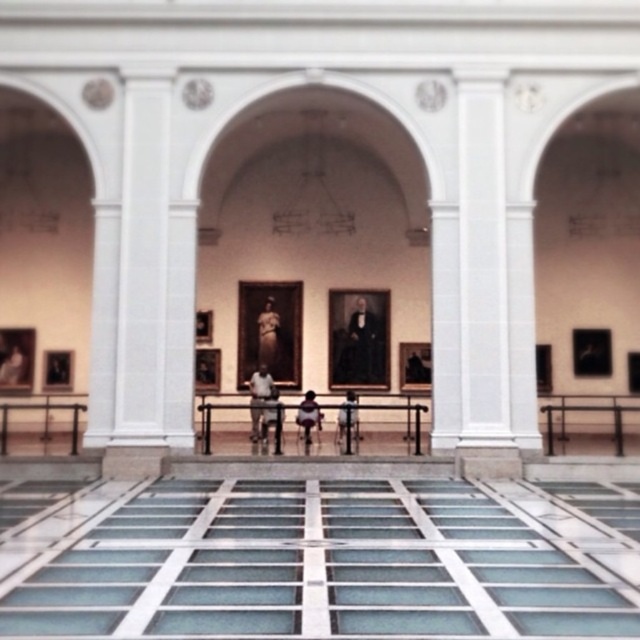
Question: Is matte gold statue at center below light brown leather jacket at center?

Choices:
 (A) no
 (B) yes

Answer: (A)

Question: Considering the relative positions of matte gold statue at center and dark brown leather jacket at center in the image provided, where is matte gold statue at center located with respect to dark brown leather jacket at center?

Choices:
 (A) left
 (B) right

Answer: (A)

Question: Which object is the closest to the light brown leather jacket at center?

Choices:
 (A) smooth black portrait at center
 (B) matte gold statue at center
 (C) dark brown leather jacket at center

Answer: (B)

Question: Estimate the real-world distances between objects in this image. Which object is closer to the matte gold statue at center?

Choices:
 (A) smooth black portrait at center
 (B) dark brown leather jacket at center
 (C) silhouette fabric child at center
 (D) light brown leather jacket at center

Answer: (A)

Question: Which point appears farthest from the camera in this image?

Choices:
 (A) (262, 400)
 (B) (339, 428)
 (C) (356, 324)

Answer: (C)

Question: Does silhouette fabric child at center come in front of dark brown leather jacket at center?

Choices:
 (A) yes
 (B) no

Answer: (B)